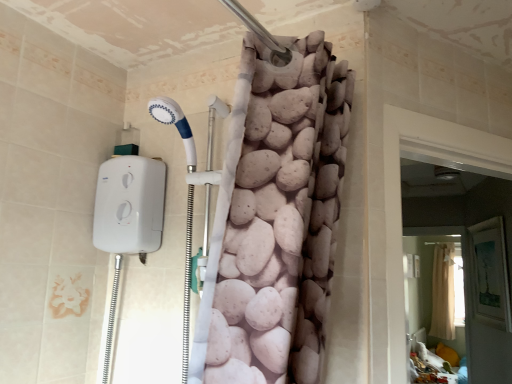
Question: Can you confirm if beige fabric screen door at lower right, which appears as the second screen door when viewed from the left, is smaller than beige fabric shower curtain at upper center?

Choices:
 (A) no
 (B) yes

Answer: (B)

Question: From a real-world perspective, is beige fabric screen door at lower right, which is counted as the 1th screen door, starting from the right, positioned under beige fabric shower curtain at upper center based on gravity?

Choices:
 (A) yes
 (B) no

Answer: (A)

Question: Is beige fabric screen door at lower right, which appears as the second screen door when viewed from the left, positioned far away from beige fabric shower curtain at upper center?

Choices:
 (A) yes
 (B) no

Answer: (B)

Question: Is beige fabric screen door at lower right, positioned as the first screen door in back-to-front order, thinner than beige fabric shower curtain at upper center?

Choices:
 (A) yes
 (B) no

Answer: (A)

Question: Does beige fabric screen door at lower right, which is counted as the 1th screen door, starting from the right, have a larger size compared to beige fabric shower curtain at upper center?

Choices:
 (A) yes
 (B) no

Answer: (B)

Question: Is beige fabric screen door at lower right, which is counted as the 1th screen door, starting from the right, surrounding beige fabric shower curtain at upper center?

Choices:
 (A) no
 (B) yes

Answer: (A)

Question: From a real-world perspective, is beige fabric shower curtain at upper center physically above beige fabric screen door at lower right, which is counted as the 1th screen door, starting from the right?

Choices:
 (A) no
 (B) yes

Answer: (B)

Question: From the image's perspective, is beige fabric shower curtain at upper center under beige fabric screen door at lower right, which is counted as the 1th screen door, starting from the right?

Choices:
 (A) yes
 (B) no

Answer: (A)

Question: Considering the relative positions of beige fabric shower curtain at upper center and beige fabric screen door at lower right, positioned as the first screen door in back-to-front order, in the image provided, is beige fabric shower curtain at upper center to the left of beige fabric screen door at lower right, positioned as the first screen door in back-to-front order, from the viewer's perspective?

Choices:
 (A) no
 (B) yes

Answer: (A)

Question: From a real-world perspective, is beige fabric shower curtain at upper center under beige fabric screen door at lower right, the 2th screen door in the front-to-back sequence?

Choices:
 (A) no
 (B) yes

Answer: (A)

Question: Does beige fabric shower curtain at upper center have a larger size compared to beige fabric screen door at lower right, which appears as the second screen door when viewed from the left?

Choices:
 (A) no
 (B) yes

Answer: (B)

Question: Does beige fabric shower curtain at upper center have a smaller size compared to beige fabric screen door at lower right, which is counted as the 1th screen door, starting from the right?

Choices:
 (A) yes
 (B) no

Answer: (B)

Question: Is the position of beige fabric screen door at lower right, which is counted as the 1th screen door, starting from the right, less distant than that of white fabric screen door at right, the 2th screen door from the back?

Choices:
 (A) no
 (B) yes

Answer: (A)